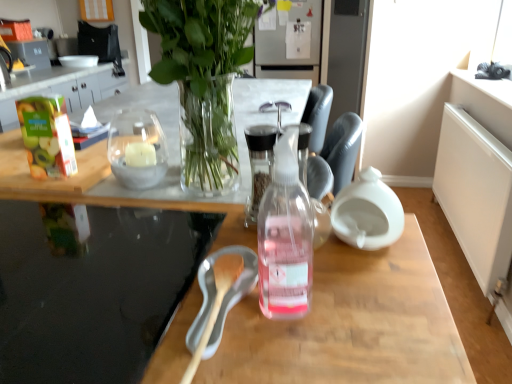
This screenshot has height=384, width=512. In order to click on vacant space underneath transparent glass table at lower left (from a real-world perspective) in this screenshot , I will do `click(94, 275)`.